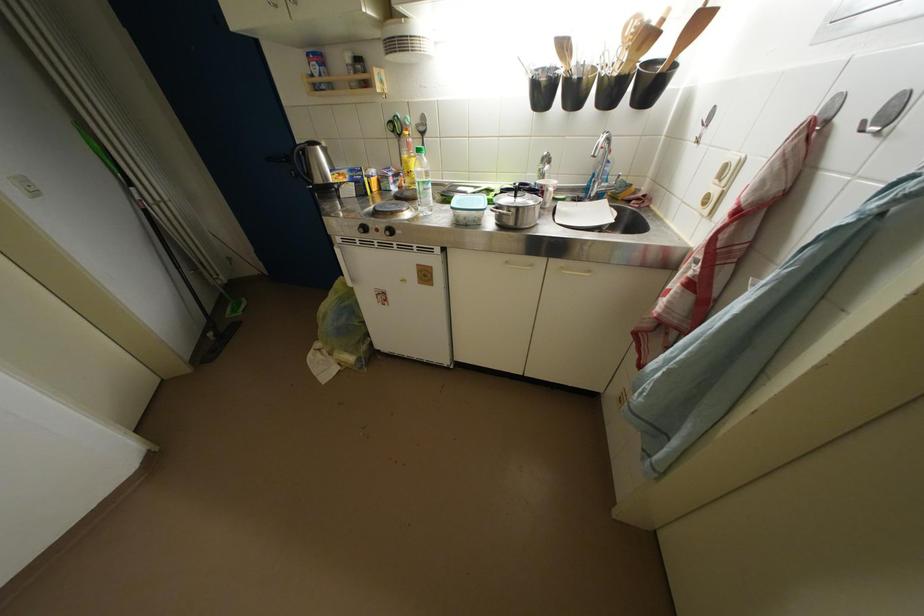
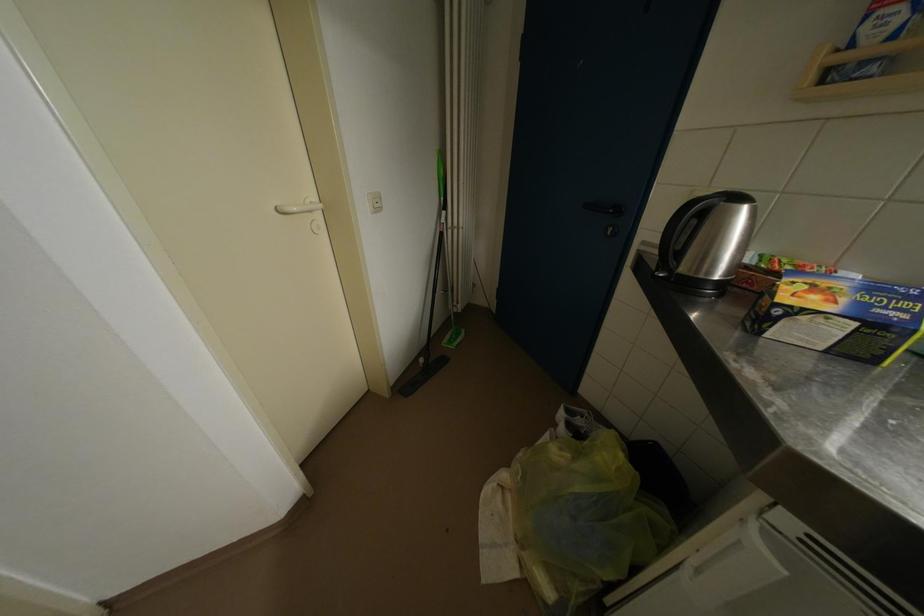
The point at (216,338) is marked in the first image. Where is the corresponding point in the second image?

(429, 363)